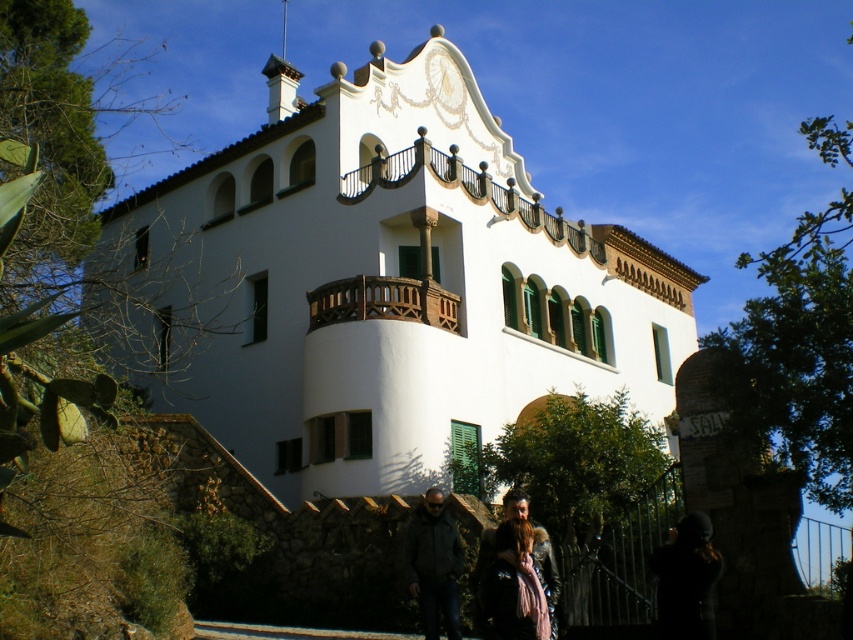
Can you confirm if dark woolen hat at lower right is positioned above leather jacket at lower center?

Indeed, dark woolen hat at lower right is positioned over leather jacket at lower center.

Is point (706, 632) positioned in front of point (532, 561)?

Yes, it is.

You are a GUI agent. You are given a task and a screenshot of the screen. Output one action in this format:
    pyautogui.click(x=<x>, y=<y>)
    Task: Click on the dark woolen hat at lower right
    Image resolution: width=853 pixels, height=640 pixels.
    Given the screenshot: What is the action you would take?
    pyautogui.click(x=686, y=579)

Consider the image. Can you confirm if white stucco building at center is positioned to the left of leather jacket at lower center?

No, white stucco building at center is not to the left of leather jacket at lower center.

Does white stucco building at center have a lesser width compared to leather jacket at lower center?

Incorrect, white stucco building at center's width is not less than leather jacket at lower center's.

Who is more distant from viewer, (x=297, y=291) or (x=544, y=614)?

The point (x=297, y=291) is more distant.

Where is `white stucco building at center`? white stucco building at center is located at coordinates (376, 284).

Is dark woolen hat at lower right positioned before dark gray jacket at center?

Yes, dark woolen hat at lower right is closer to the viewer.

Is point (700, 532) more distant than point (459, 561)?

That is False.

I want to click on dark woolen hat at lower right, so click(x=686, y=579).